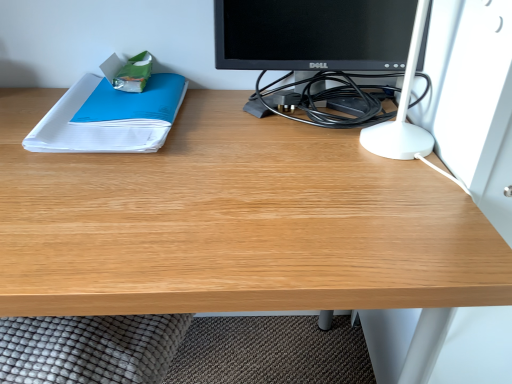
Question: From the image's perspective, does black glossy monitor at upper center appear higher than white paper at left?

Choices:
 (A) no
 (B) yes

Answer: (B)

Question: Considering the relative sizes of black glossy monitor at upper center and white paper at left in the image provided, is black glossy monitor at upper center smaller than white paper at left?

Choices:
 (A) yes
 (B) no

Answer: (B)

Question: Considering the relative sizes of black glossy monitor at upper center and white paper at left in the image provided, is black glossy monitor at upper center shorter than white paper at left?

Choices:
 (A) no
 (B) yes

Answer: (A)

Question: Would you consider black glossy monitor at upper center to be distant from white paper at left?

Choices:
 (A) yes
 (B) no

Answer: (B)

Question: Is black glossy monitor at upper center behind white paper at left?

Choices:
 (A) yes
 (B) no

Answer: (B)

Question: Can white paper at left be found inside black glossy monitor at upper center?

Choices:
 (A) no
 (B) yes

Answer: (A)

Question: Can you confirm if white paper at left is wider than black glossy monitor at upper center?

Choices:
 (A) yes
 (B) no

Answer: (A)

Question: Is white paper at left at the left side of black glossy monitor at upper center?

Choices:
 (A) yes
 (B) no

Answer: (A)

Question: Can you confirm if white paper at left is smaller than black glossy monitor at upper center?

Choices:
 (A) no
 (B) yes

Answer: (B)

Question: Is white paper at left facing away from black glossy monitor at upper center?

Choices:
 (A) no
 (B) yes

Answer: (A)

Question: From a real-world perspective, is white paper at left positioned under black glossy monitor at upper center based on gravity?

Choices:
 (A) yes
 (B) no

Answer: (A)

Question: Can you see white paper at left touching black glossy monitor at upper center?

Choices:
 (A) no
 (B) yes

Answer: (A)

Question: From the image's perspective, is black glossy monitor at upper center located above or below white paper at left?

Choices:
 (A) below
 (B) above

Answer: (B)